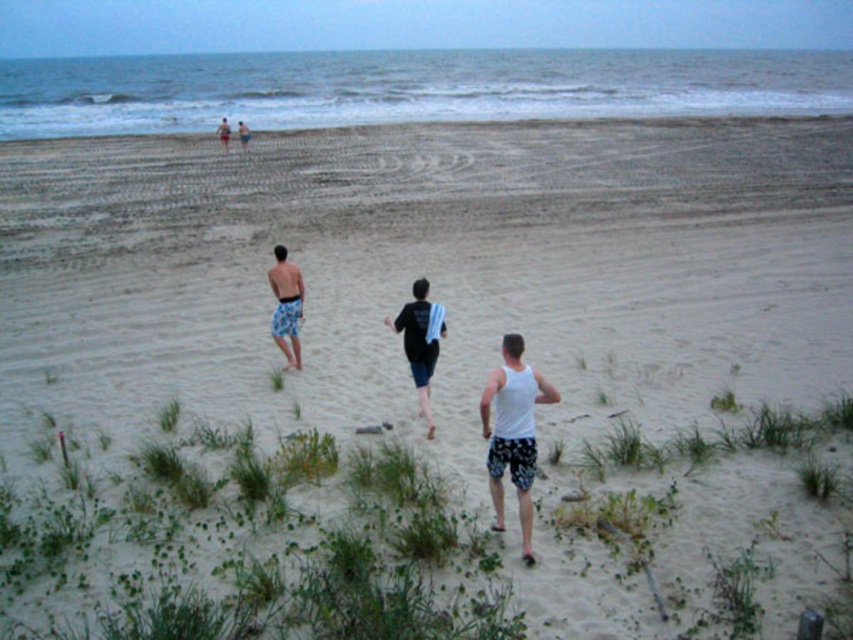
Who is positioned more to the right, dark blue denim shorts at center or blue shorts at center?

dark blue denim shorts at center is more to the right.

Can you confirm if dark blue denim shorts at center is positioned above blue shorts at center?

Incorrect, dark blue denim shorts at center is not positioned above blue shorts at center.

Find the location of a particular element. The image size is (853, 640). dark blue denim shorts at center is located at coordinates (421, 340).

I want to click on dark blue denim shorts at center, so click(x=421, y=340).

What do you see at coordinates (286, 305) in the screenshot? I see `blue printed shorts at center` at bounding box center [286, 305].

Between blue printed shorts at center and blue shorts at center, which one appears on the right side from the viewer's perspective?

blue printed shorts at center

Is point (289, 355) positioned before point (241, 144)?

Yes, it is in front of point (241, 144).

Where is `blue printed shorts at center`? The image size is (853, 640). blue printed shorts at center is located at coordinates (286, 305).

Does white tank top at center have a lesser height compared to blue printed shorts at center?

In fact, white tank top at center may be taller than blue printed shorts at center.

Is white tank top at center in front of blue printed shorts at center?

That is True.

Which is in front, point (496, 488) or point (293, 266)?

Point (496, 488)

The width and height of the screenshot is (853, 640). Find the location of `white tank top at center`. white tank top at center is located at coordinates (514, 433).